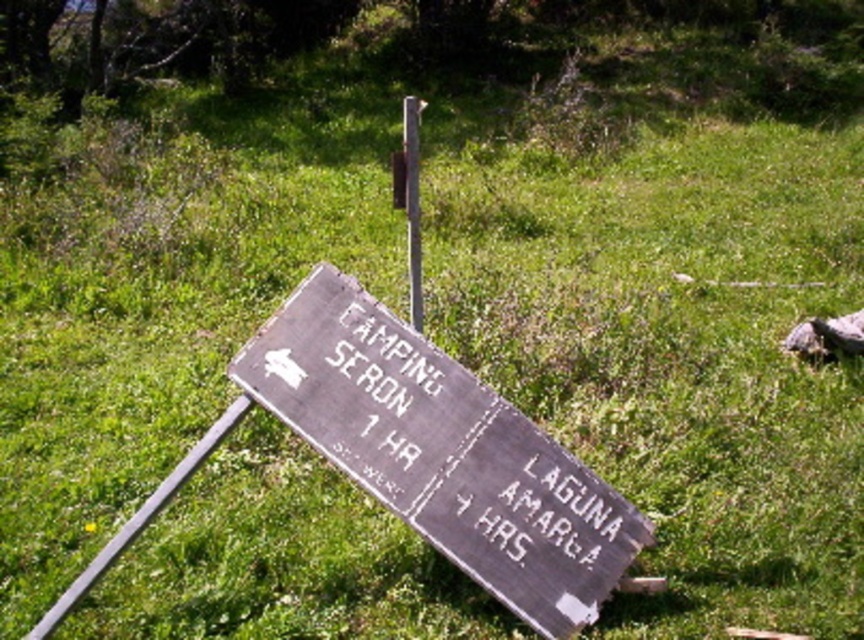
Can you confirm if weathered wood sign at lower center is positioned below metallic pole at center?

Yes.

Which is behind, point (454, 472) or point (413, 308)?

Positioned behind is point (413, 308).

Identify the location of weathered wood sign at lower center. (442, 452).